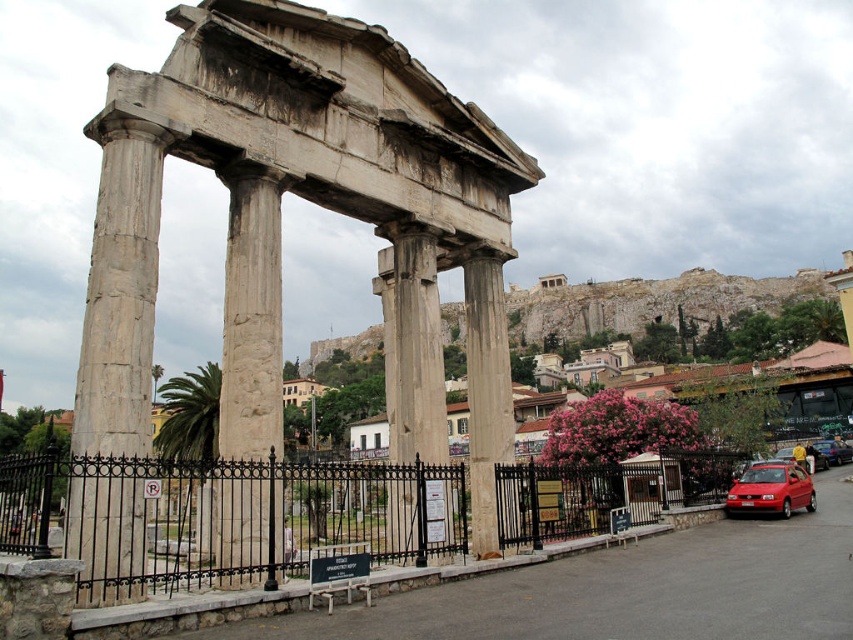
Question: Which object is closer to the camera taking this photo?

Choices:
 (A) gray stone column at center
 (B) white marble column at center
 (C) shiny red hatchback at lower right
 (D) marble column at center

Answer: (B)

Question: Which point is farther to the camera?

Choices:
 (A) white stone columns at center
 (B) white marble column at center

Answer: (B)

Question: In this image, where is white marble column at left located relative to white marble column at center?

Choices:
 (A) right
 (B) left

Answer: (A)

Question: Can you confirm if marble column at center is smaller than red matte car at lower right?

Choices:
 (A) no
 (B) yes

Answer: (A)

Question: Is white marble column at center closer to camera compared to shiny red hatchback at lower right?

Choices:
 (A) yes
 (B) no

Answer: (A)

Question: Considering the real-world distances, which object is closest to the white marble column at left?

Choices:
 (A) metallic silver car at lower right
 (B) white stone columns at center
 (C) red matte car at lower right

Answer: (B)